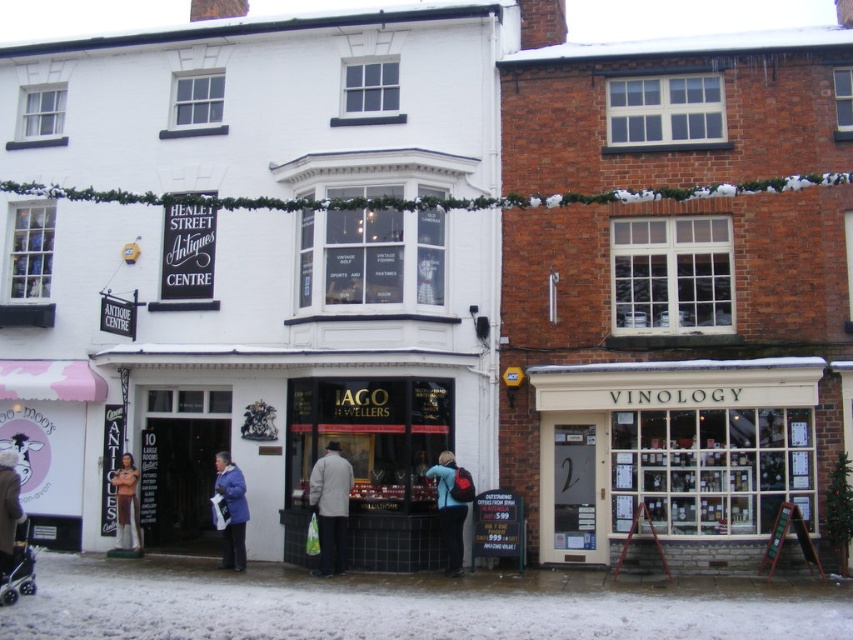
What do you see at coordinates (671, 449) in the screenshot? The height and width of the screenshot is (640, 853). I see `white wooden storefront at lower right` at bounding box center [671, 449].

Does white wooden storefront at lower right have a lesser height compared to light gray fabric coat at center?

In fact, white wooden storefront at lower right may be taller than light gray fabric coat at center.

Find the location of `white wooden storefront at lower right`. white wooden storefront at lower right is located at coordinates (671, 449).

Is white snow at ground center wider than matte brown statue at center?

Yes, white snow at ground center is wider than matte brown statue at center.

In order to click on white snow at ground center in this screenshot , I will do `click(399, 608)`.

Where is `white snow at ground center`? This screenshot has width=853, height=640. white snow at ground center is located at coordinates (399, 608).

Is point (308, 440) positioned behind point (13, 524)?

That is True.

Does matte gold jewelry at center have a greater height compared to dark blue coat at lower left?

Incorrect, matte gold jewelry at center's height is not larger of dark blue coat at lower left's.

Find the location of `matte gold jewelry at center`. matte gold jewelry at center is located at coordinates (370, 465).